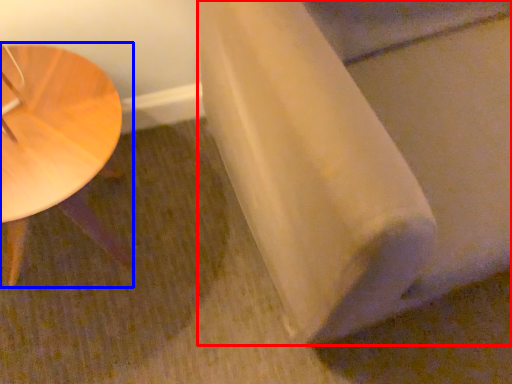
Question: Which point is closer to the camera, linen (highlighted by a red box) or table (highlighted by a blue box)?

Choices:
 (A) linen
 (B) table

Answer: (A)